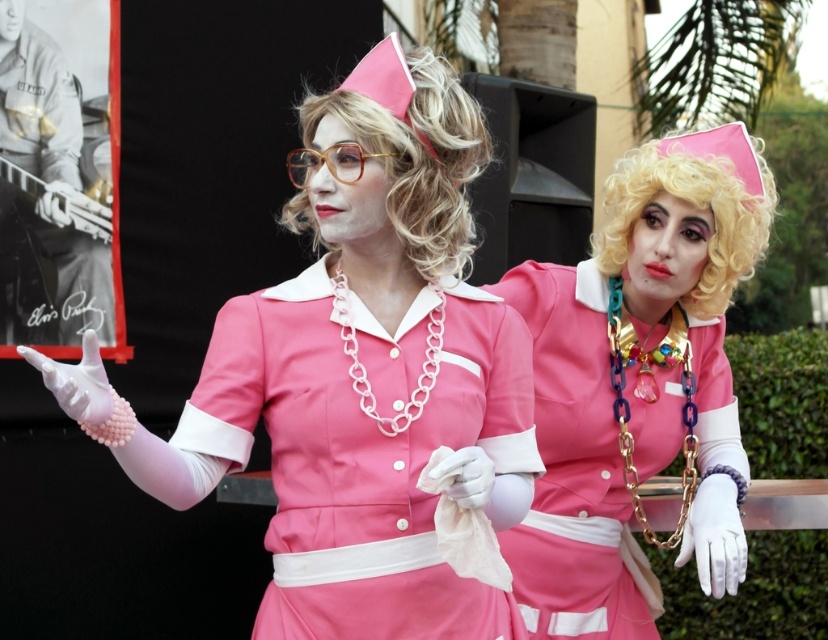
You are a costume designer preparing for a play and need to arrange the matte pink fabric dress at center and the blonde curly wig at upper center on a mannequin. Based on the image, which item should be placed higher on the mannequin?

The blonde curly wig at upper center should be placed higher on the mannequin than the matte pink fabric dress at center because the matte pink fabric dress at center is below the blonde curly wig at upper center in the image.

You are standing in front of the two individuals in the image. Which point, point [474,620] or point [607,180], is closer to you?

Point [474,620] is closer to the viewer than point [607,180].